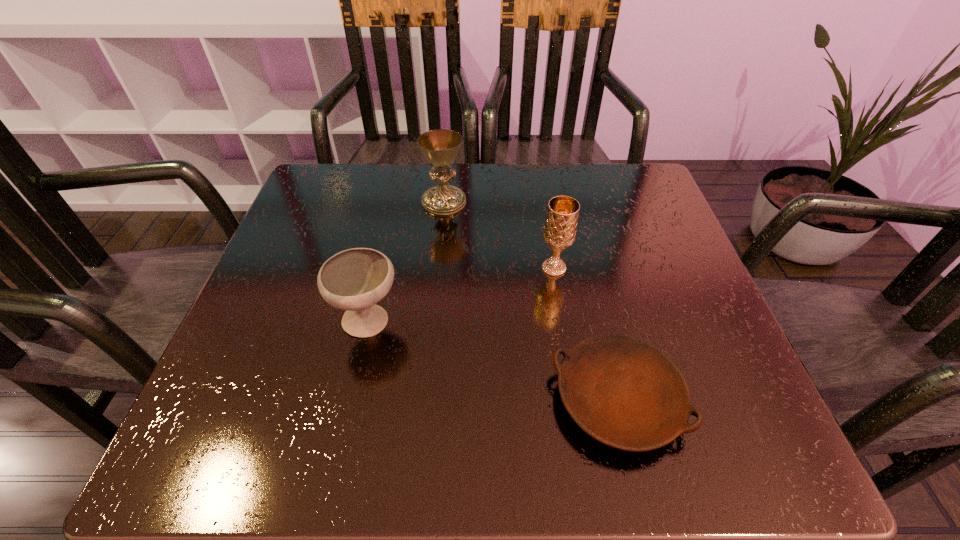
Find the location of a particular element. This screenshot has height=540, width=960. vacant space at the near left corner of the desktop is located at coordinates (205, 429).

This screenshot has width=960, height=540. In order to click on free space at the far right corner of the desktop in this screenshot , I will do `click(590, 191)`.

Where is `free region at the near right corner of the desktop`? free region at the near right corner of the desktop is located at coordinates (755, 462).

Where is `vacant space that is in between the shortest object and the second chalice from right to left`? The width and height of the screenshot is (960, 540). vacant space that is in between the shortest object and the second chalice from right to left is located at coordinates (531, 301).

Locate an element on the screen. blank region between the rightmost chalice and the farthest object is located at coordinates (499, 235).

Locate an element on the screen. free space between the leftmost chalice and the rightmost chalice is located at coordinates (462, 295).

Locate an element on the screen. vacant area between the second farthest object and the leftmost object is located at coordinates (462, 295).

Where is `free point between the plate and the farthest chalice`? free point between the plate and the farthest chalice is located at coordinates (531, 301).

Locate an element on the screen. The image size is (960, 540). free spot between the second chalice from left to right and the second farthest object is located at coordinates (499, 235).

This screenshot has height=540, width=960. In order to click on vacant area that lies between the shortest object and the nearest chalice in this screenshot , I will do `click(492, 361)`.